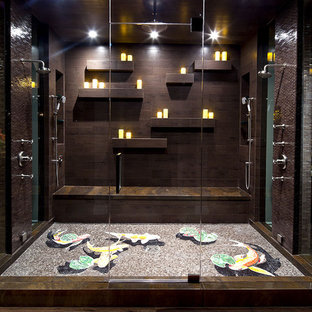
At what (x,y) coordinates should I click in order to perform the action: click on candles. Please return your answer as a coordinate pair (x, y). This screenshot has height=312, width=312. Looking at the image, I should click on click(x=222, y=53), click(x=140, y=82), click(x=93, y=83), click(x=165, y=111).